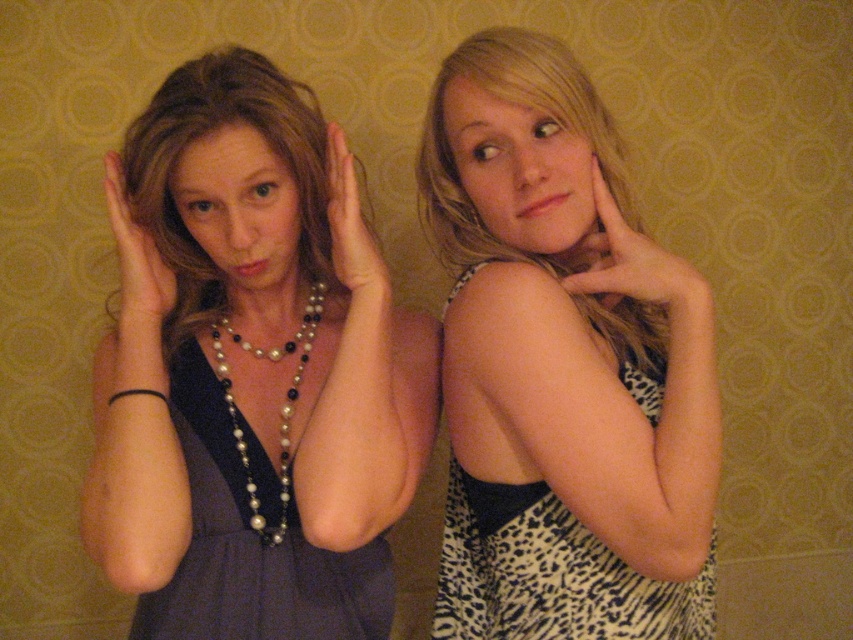
You are a fashion designer observing two dresses in an image. You see the leopard print dress at center and the dark blue satin dress at left. Which dress is bigger in size?

The leopard print dress at center is larger in size compared to the dark blue satin dress at left.

You are a photographer adjusting the lighting for a portrait. You notice the pearl necklace at center and the smooth skin hand at right in the frame. Which object is closer to the camera lens?

The pearl necklace at center is positioned over the smooth skin hand at right, meaning it is closer to the camera lens.